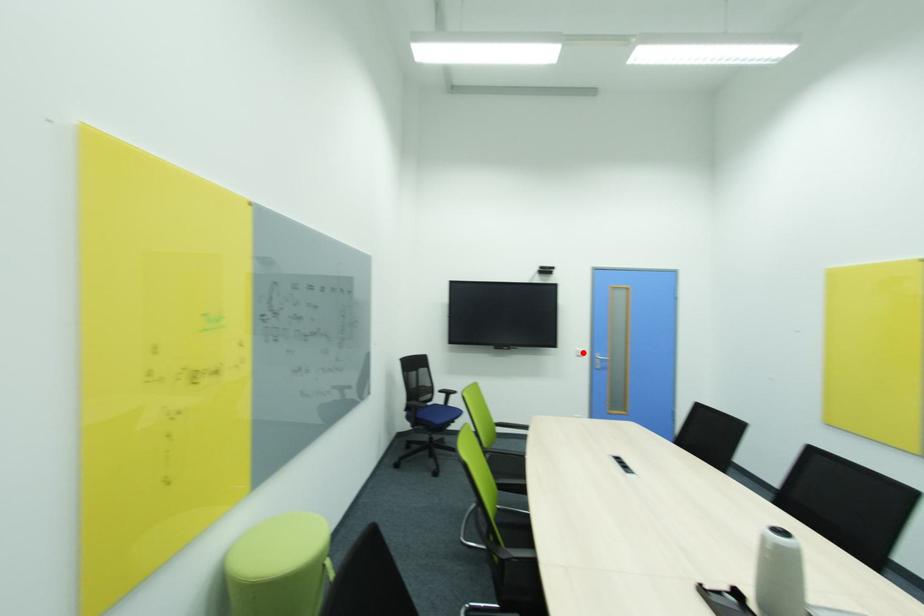
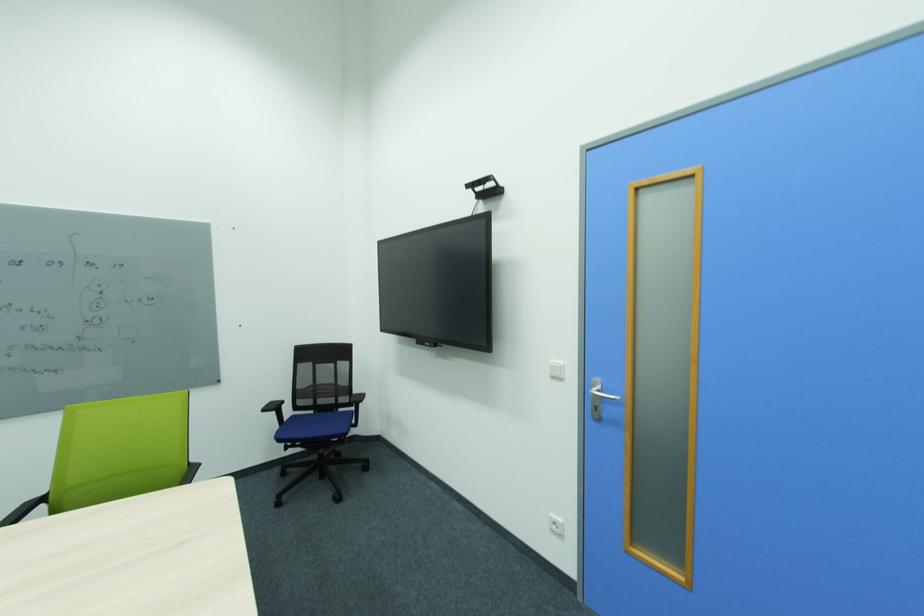
Where in the second image is the point corresponding to the highlighted location from the first image?

(557, 368)